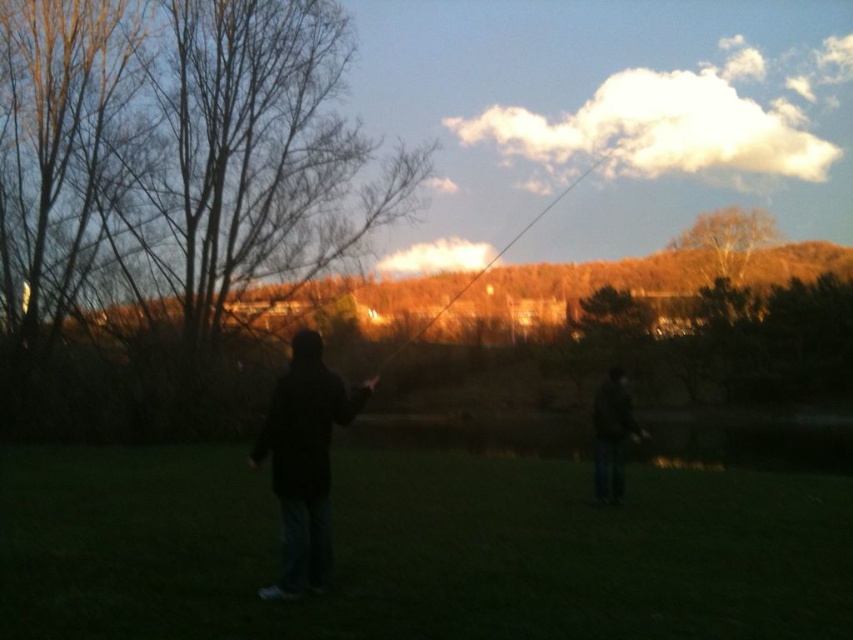
You are standing in the outdoor scene and want to walk from the green grass at center to the smooth wooden rod at upper center. Which direction should you move to reach the rod?

To reach the smooth wooden rod at upper center from the green grass at center, you should move to the right since the green grass at center is located to the left of the rod.

You are navigating a drone over the serene outdoor scene. The drone needs to drop a small package at the exact coordinates where the black matte jacket at center is located. What are the coordinates for the drop zone?

The coordinates for the drop zone are at point [305,461], where the black matte jacket at center is located.